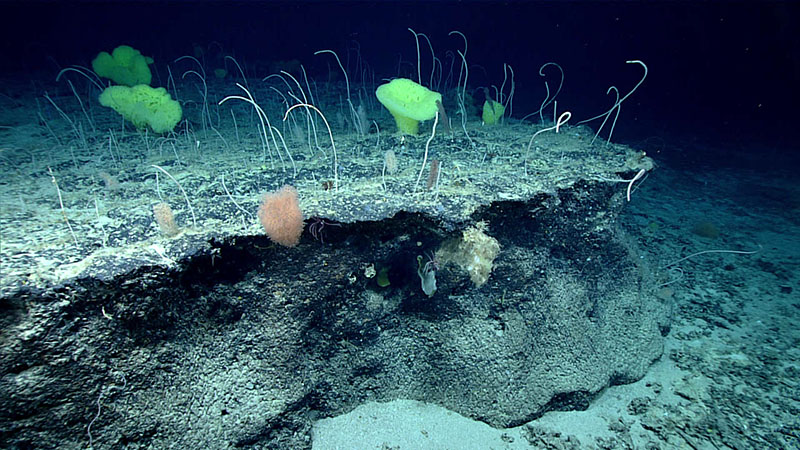
Find the location of `green sponge`. green sponge is located at coordinates (142, 104), (120, 68), (410, 99), (493, 108).